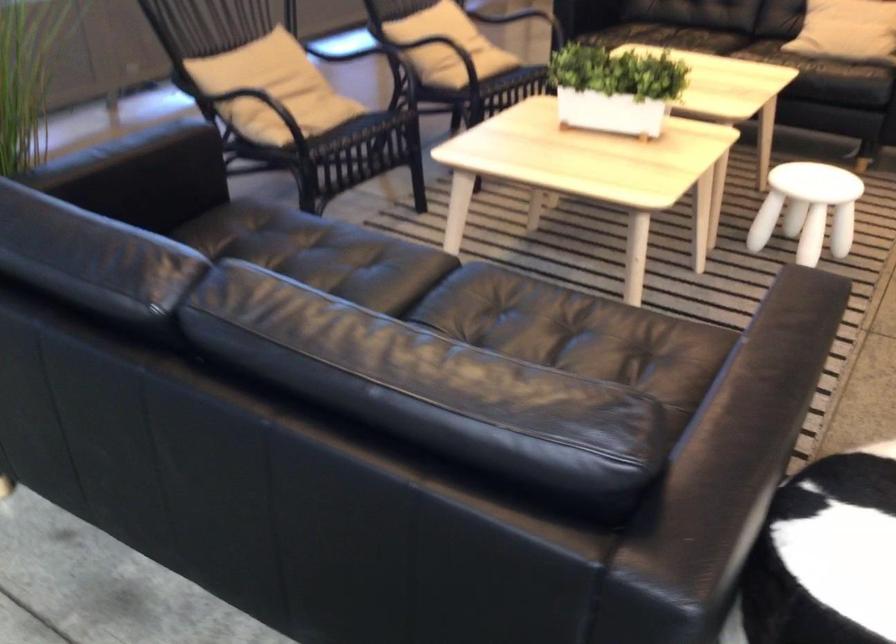
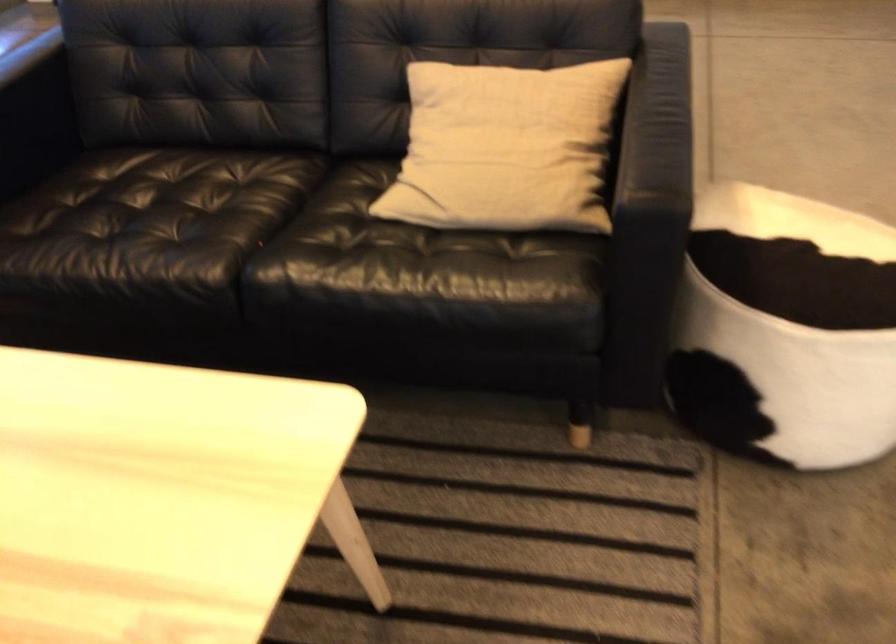
Which direction would the cameraman need to move to produce the second image?

The cameraman walked toward right, forward.